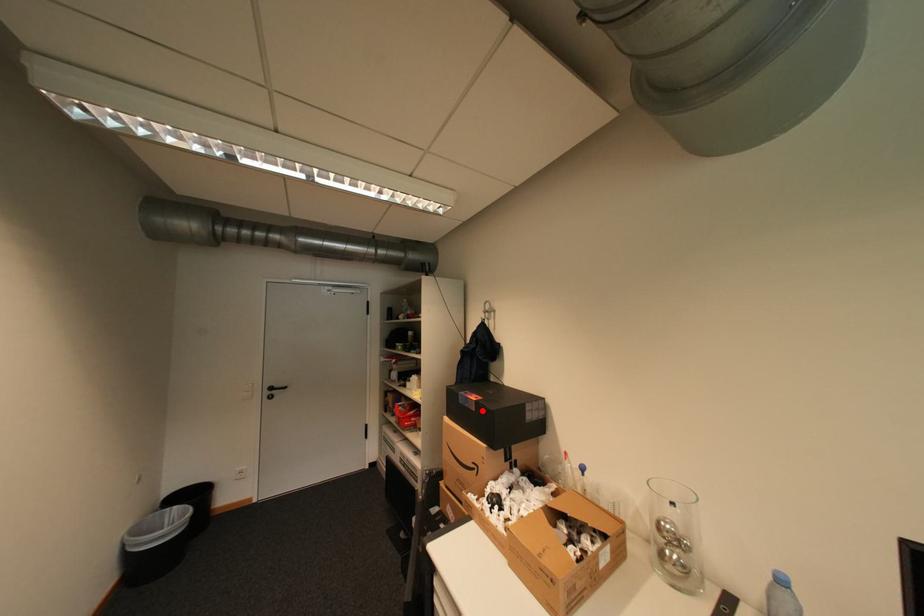
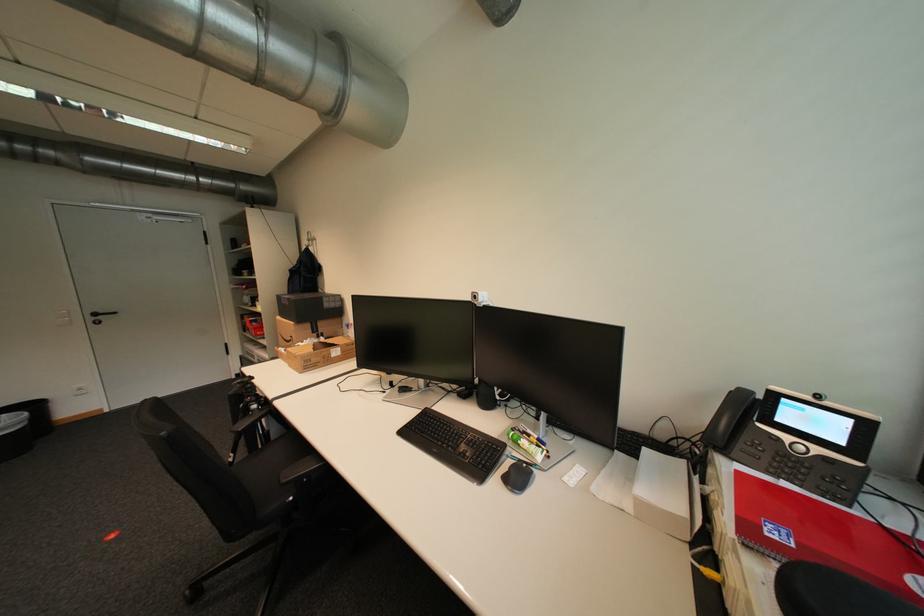
Where in the second image is the point corresponding to the highlighted location from the first image?

(296, 305)